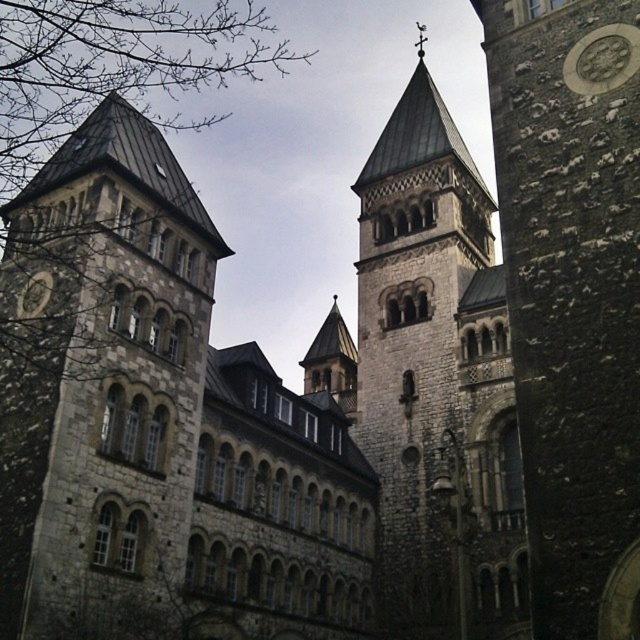
Does rough stone clock tower at right appear on the left side of stone textured tower at center?

No, rough stone clock tower at right is not to the left of stone textured tower at center.

Does point (552, 246) come behind point (291, 566)?

No, (552, 246) is in front of (291, 566).

Between point (547, 310) and point (404, 401), which one is positioned in front?

Positioned in front is point (547, 310).

Locate an element on the screen. This screenshot has width=640, height=640. rough stone clock tower at right is located at coordinates (572, 296).

Does stone tower at left have a greater height compared to stone textured tower at center?

In fact, stone tower at left may be shorter than stone textured tower at center.

Which is in front, point (173, 410) or point (428, 291)?

Positioned in front is point (173, 410).

Which is in front, point (131, 324) or point (483, 461)?

Point (131, 324) is more forward.

Locate an element on the screen. The image size is (640, 640). stone tower at left is located at coordinates (100, 374).

Does rough stone clock tower at right have a greater height compared to silver metallic clock at upper right?

Indeed, rough stone clock tower at right has a greater height compared to silver metallic clock at upper right.

Which is in front, point (577, 632) or point (596, 42)?

Point (577, 632) is more forward.

At what (x,y) coordinates should I click in order to perform the action: click on rough stone clock tower at right. Please return your answer as a coordinate pair (x, y). Looking at the image, I should click on (572, 296).